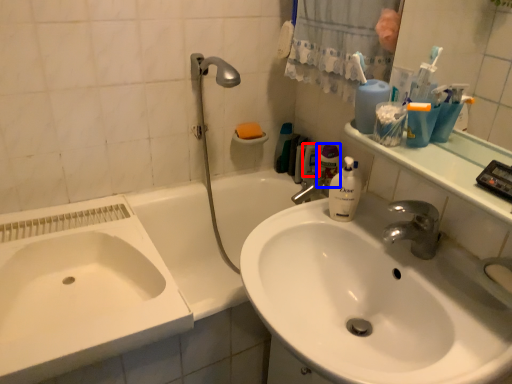
Question: Which object appears farthest to the camera in this image, mouthwash (highlighted by a red box) or cleaning product (highlighted by a blue box)?

Choices:
 (A) mouthwash
 (B) cleaning product

Answer: (A)